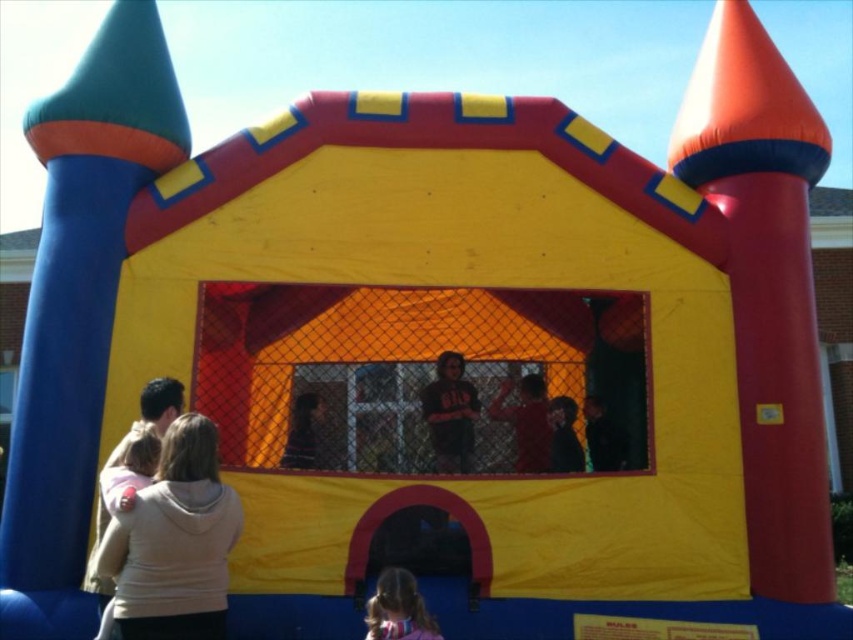
You are a photographer trying to capture a group photo of the beige fleece jacket at lower left and the smooth pink hair at lower center. Since you want to ensure both subjects are in focus, you need to know which one is wider. Which object is wider?

The beige fleece jacket at lower left is wider than the smooth pink hair at lower center.

You are a parent holding a beige fleece jacket at lower left and need to hand it to your child with smooth pink hair at lower center. Can you reach them without moving from your current position?

The distance between the beige fleece jacket at lower left and smooth pink hair at lower center is 1.04 meters. Since the average human arm span is about 1 meter, you might not be able to reach them without moving closer.